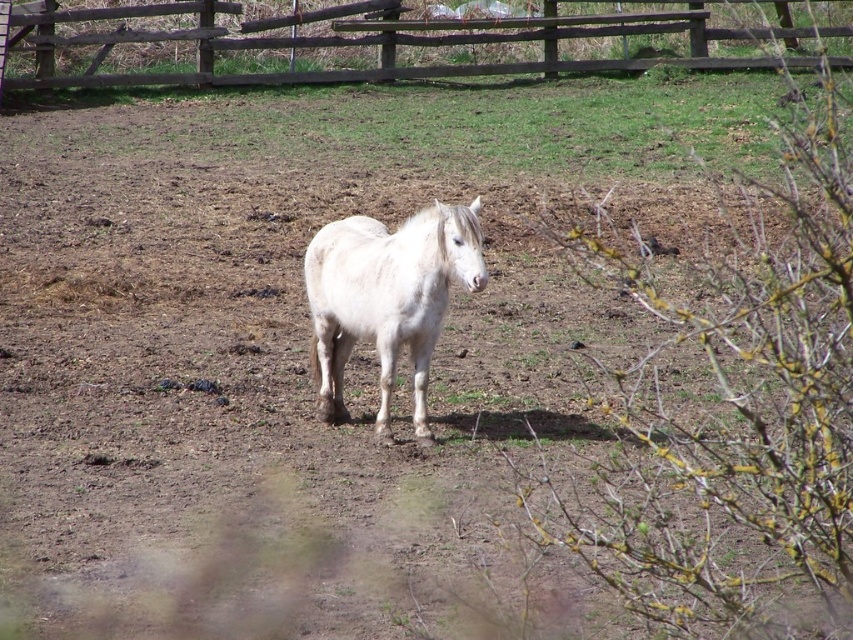
You are a farmer checking the condition of your enclosure. You notice the green grass at upper center and the brown wooden fence at upper center. Which one has a smaller width?

The green grass at upper center is thinner than the brown wooden fence at upper center, so the green grass at upper center has a smaller width.

You are a farmer checking the enclosure for your white matte horse at center. You notice the brown wooden fence at upper center. Is the fence blocking the horse from exiting the enclosure?

The brown wooden fence at upper center is positioned over the white matte horse at center, meaning it is directly above the horse, likely forming part of the enclosure structure. This placement would block the horse from exiting the enclosure as the fence is overhead and enclosing the area.